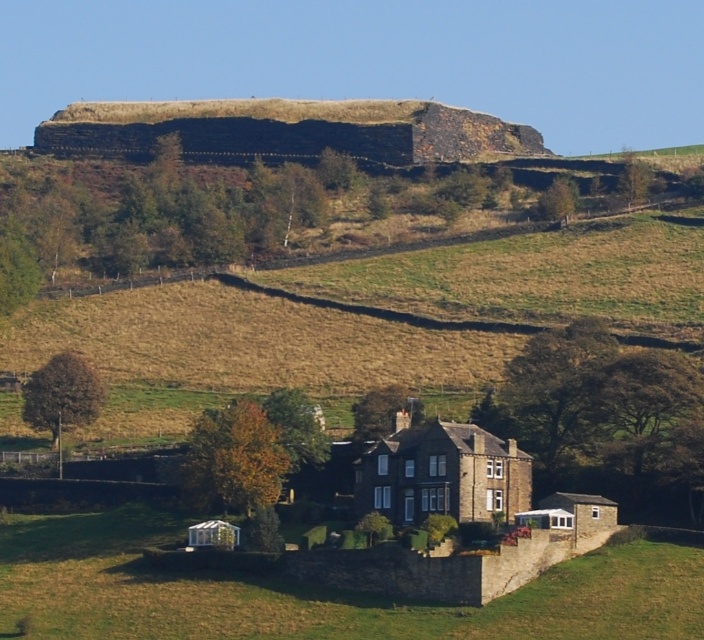
Question: Does green grass at lower center appear under brown stone house at center?

Choices:
 (A) no
 (B) yes

Answer: (B)

Question: Which of the following is the farthest from the observer?

Choices:
 (A) brown stone house at center
 (B) green grass at lower center

Answer: (A)

Question: Among these objects, which one is nearest to the camera?

Choices:
 (A) brown stone house at center
 (B) green grass at lower center

Answer: (B)

Question: Does green grass at lower center have a greater width compared to brown stone house at center?

Choices:
 (A) no
 (B) yes

Answer: (B)

Question: Can you confirm if green grass at lower center is wider than brown stone house at center?

Choices:
 (A) no
 (B) yes

Answer: (B)